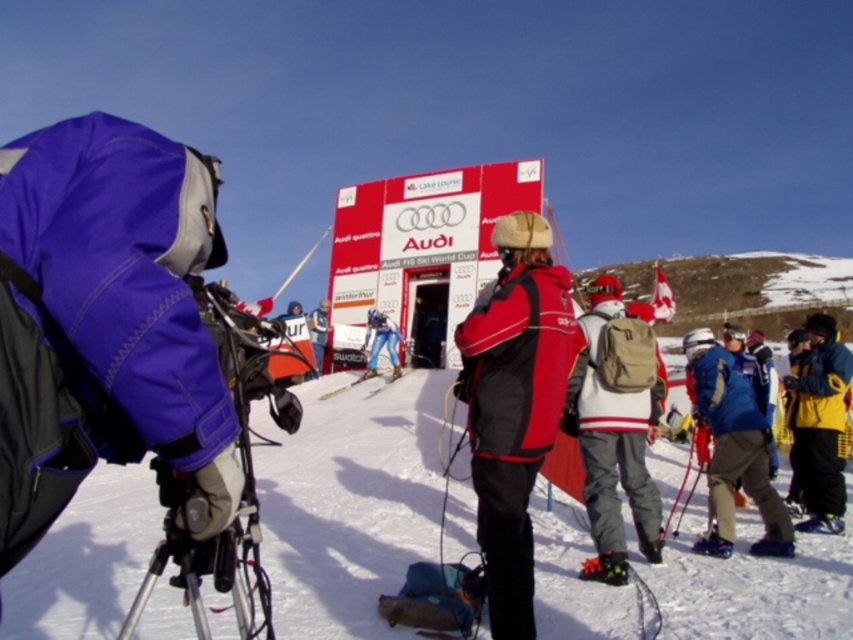
Question: Which is farther from the blue synthetic jacket at center?

Choices:
 (A) white snow at center
 (B) beige fabric backpack at center

Answer: (A)

Question: Can you confirm if beige fabric backpack at center is positioned below yellow jacket at center?

Choices:
 (A) yes
 (B) no

Answer: (B)

Question: Which point is closer to the camera taking this photo?

Choices:
 (A) (641, 458)
 (B) (488, 397)
 (C) (824, 513)

Answer: (B)

Question: Does red matte jacket at center appear on the left side of yellow jacket at center?

Choices:
 (A) yes
 (B) no

Answer: (A)

Question: Does red matte jacket at center come behind yellow jacket at center?

Choices:
 (A) no
 (B) yes

Answer: (A)

Question: Which object is the closest to the red matte jacket at center?

Choices:
 (A) yellow jacket at center
 (B) blue synthetic jacket at center
 (C) beige fabric backpack at center

Answer: (C)